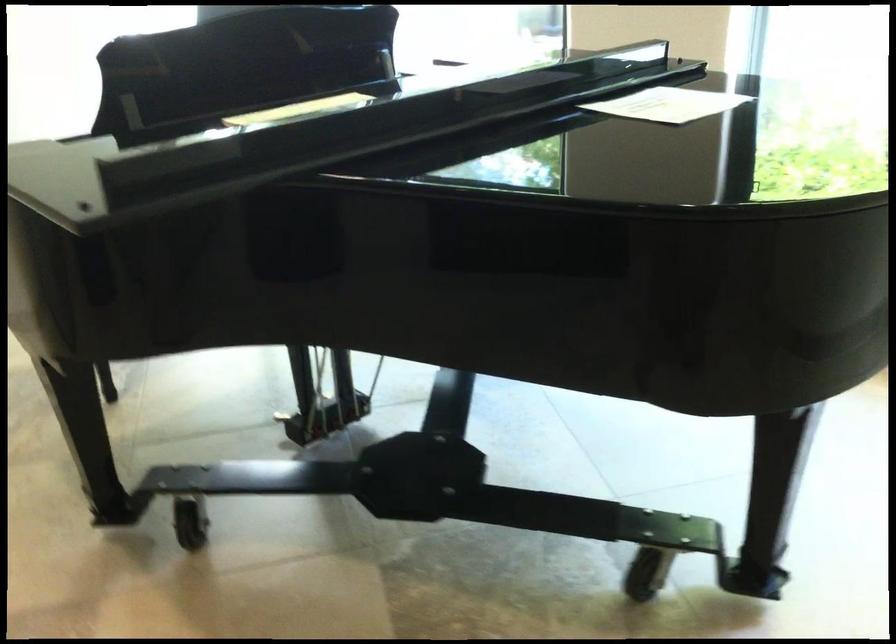
Where is `black music stand`? black music stand is located at coordinates (255, 55).